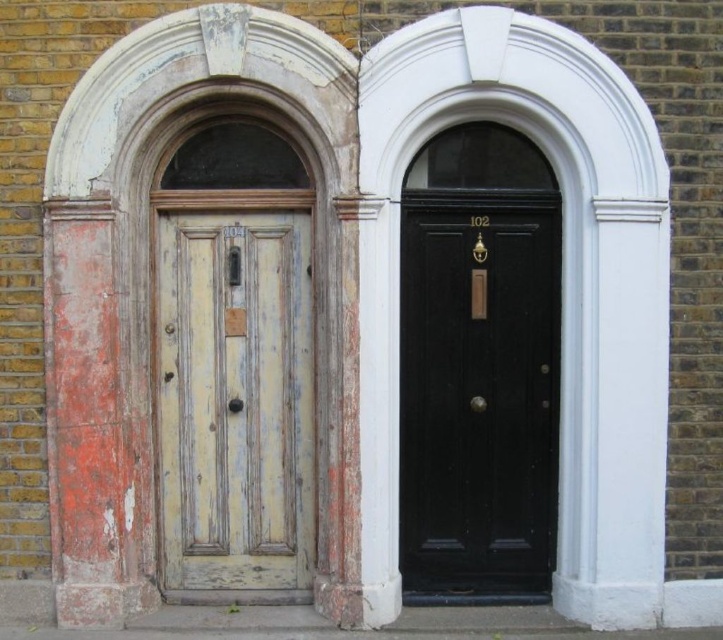
Is black polished wood door at center taller than yellowish wood door at center?

Yes.

Does black polished wood door at center have a larger size compared to yellowish wood door at center?

Indeed, black polished wood door at center has a larger size compared to yellowish wood door at center.

Locate an element on the screen. black polished wood door at center is located at coordinates (479, 388).

The width and height of the screenshot is (723, 640). Identify the location of black polished wood door at center. (479, 388).